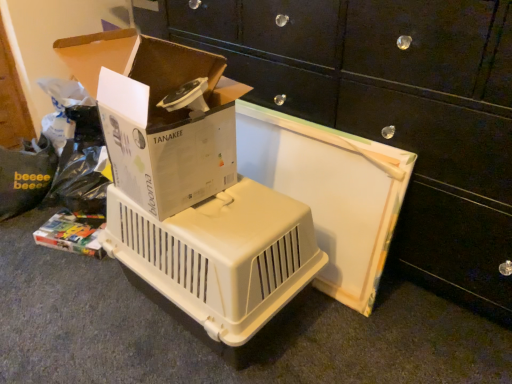
The image size is (512, 384). What do you see at coordinates (391, 111) in the screenshot?
I see `white plastic pet carrier at center` at bounding box center [391, 111].

The height and width of the screenshot is (384, 512). Identify the location of white cardboard box at upper left. (158, 117).

Measure the distance from beige plastic pet carrier at center to white plastic pet carrier at center.

They are 18.12 inches apart.

Based on the photo, in terms of height, does beige plastic pet carrier at center look taller or shorter compared to white plastic pet carrier at center?

beige plastic pet carrier at center is shorter than white plastic pet carrier at center.

From a real-world perspective, between beige plastic pet carrier at center and white plastic pet carrier at center, who is vertically lower?

beige plastic pet carrier at center is physically lower.

Is point (244, 217) in front of point (348, 77)?

Yes, it is.

Considering the positions of points (144, 133) and (200, 28), is point (144, 133) closer to camera compared to point (200, 28)?

Yes, it is in front of point (200, 28).

Considering the relative sizes of white cardboard box at upper left and white plastic pet carrier at center in the image provided, is white cardboard box at upper left shorter than white plastic pet carrier at center?

Yes.

Considering the positions of objects white cardboard box at upper left and white plastic pet carrier at center in the image provided, who is more to the left, white cardboard box at upper left or white plastic pet carrier at center?

From the viewer's perspective, white cardboard box at upper left appears more on the left side.

Based on the photo, which is correct: white cardboard box at upper left is inside white plastic pet carrier at center, or outside of it?

white cardboard box at upper left is located beyond the bounds of white plastic pet carrier at center.

Considering the relative positions of white cardboard box at upper left and beige plastic pet carrier at center in the image provided, is white cardboard box at upper left to the left of beige plastic pet carrier at center from the viewer's perspective?

Yes.

Could you tell me if white cardboard box at upper left is facing beige plastic pet carrier at center?

No, white cardboard box at upper left is not turned towards beige plastic pet carrier at center.

Can you see beige plastic pet carrier at center touching white cardboard box at upper left?

beige plastic pet carrier at center and white cardboard box at upper left are clearly separated.

Which object is more forward, beige plastic pet carrier at center or white cardboard box at upper left?

white cardboard box at upper left.

From a real-world perspective, is beige plastic pet carrier at center positioned above or below white cardboard box at upper left?

Clearly, from a real-world perspective, beige plastic pet carrier at center is below white cardboard box at upper left.

Would you say beige plastic pet carrier at center is to the left or to the right of white cardboard box at upper left in the picture?

From the image, it's evident that beige plastic pet carrier at center is to the right of white cardboard box at upper left.

Is point (276, 51) closer to viewer compared to point (150, 40)?

No, it is not.

In the scene shown: Can you confirm if white plastic pet carrier at center is smaller than white cardboard box at upper left?

Actually, white plastic pet carrier at center might be larger than white cardboard box at upper left.

From the picture: From the image's perspective, would you say white plastic pet carrier at center is positioned over white cardboard box at upper left?

Yes, from the image's perspective, white plastic pet carrier at center is on top of white cardboard box at upper left.

At what (x,y) coordinates should I click in order to perform the action: click on furniture in front of the white cardboard box at upper left. Please return your answer as a coordinate pair (x, y). The image size is (512, 384). Looking at the image, I should click on (391, 111).

Where is `furniture in front of the beige plastic pet carrier at center`? Image resolution: width=512 pixels, height=384 pixels. furniture in front of the beige plastic pet carrier at center is located at coordinates (391, 111).

Is white plastic pet carrier at center not within beige plastic pet carrier at center?

Yes.

In terms of size, does white plastic pet carrier at center appear bigger or smaller than beige plastic pet carrier at center?

Considering their sizes, white plastic pet carrier at center takes up more space than beige plastic pet carrier at center.

Does white plastic pet carrier at center appear on the left side of beige plastic pet carrier at center?

Incorrect, white plastic pet carrier at center is not on the left side of beige plastic pet carrier at center.

I want to click on appliance below the white plastic pet carrier at center (from the image's perspective), so click(220, 255).

Image resolution: width=512 pixels, height=384 pixels. Find the location of `furniture that is in front of the white cardboard box at upper left`. furniture that is in front of the white cardboard box at upper left is located at coordinates [x=391, y=111].

Based on their spatial positions, is beige plastic pet carrier at center or white cardboard box at upper left further from white plastic pet carrier at center?

Among the two, beige plastic pet carrier at center is located further to white plastic pet carrier at center.

Based on their spatial positions, is white cardboard box at upper left or white plastic pet carrier at center closer to beige plastic pet carrier at center?

Based on the image, white cardboard box at upper left appears to be nearer to beige plastic pet carrier at center.

Which object lies further to the anchor point white cardboard box at upper left, white plastic pet carrier at center or beige plastic pet carrier at center?

white plastic pet carrier at center is positioned further to the anchor white cardboard box at upper left.

Estimate the real-world distances between objects in this image. Which object is closer to white plastic pet carrier at center, white cardboard box at upper left or beige plastic pet carrier at center?

Based on the image, white cardboard box at upper left appears to be nearer to white plastic pet carrier at center.

Estimate the real-world distances between objects in this image. Which object is closer to white cardboard box at upper left, beige plastic pet carrier at center or white plastic pet carrier at center?

beige plastic pet carrier at center.

Consider the image. Looking at the image, which one is located further to beige plastic pet carrier at center, white plastic pet carrier at center or white cardboard box at upper left?

white plastic pet carrier at center.

I want to click on appliance situated between white cardboard box at upper left and white plastic pet carrier at center from left to right, so click(x=220, y=255).